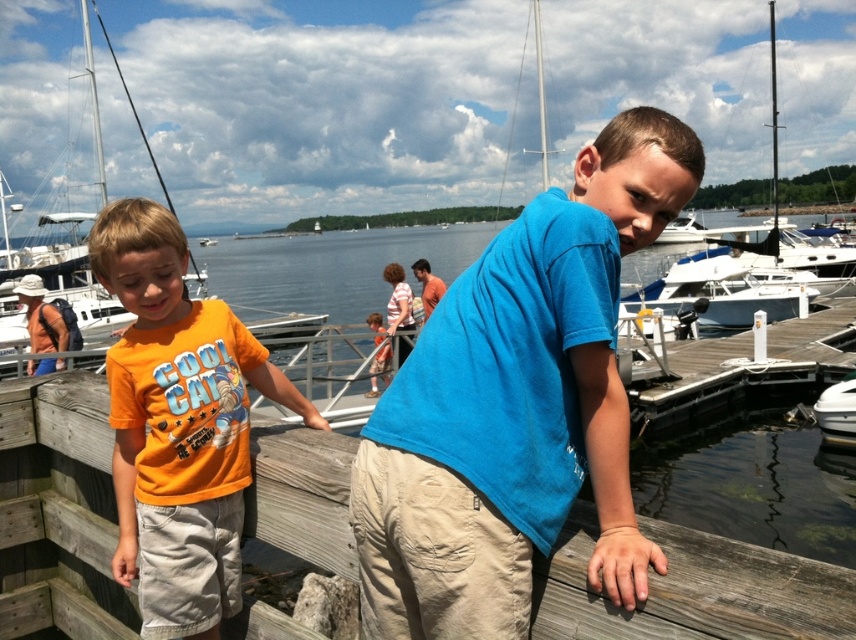
Question: Among these objects, which one is nearest to the camera?

Choices:
 (A) white matte boat at lower right
 (B) orange cotton shirt at center
 (C) transparent water at center
 (D) wooden dock at center

Answer: (C)

Question: Is blue cotton shirt at center wider than white plastic boat at left?

Choices:
 (A) yes
 (B) no

Answer: (B)

Question: Considering the real-world distances, which object is closest to the orange cotton shirt at center?

Choices:
 (A) striped cotton shirt at center
 (B) transparent water at center
 (C) white plastic boat at left
 (D) blue cotton shirt at center

Answer: (A)

Question: Which object is positioned closest to the striped cotton shirt at center?

Choices:
 (A) white matte boat at center
 (B) blue cotton shirt at center

Answer: (B)

Question: Does blue cotton shirt at center appear under striped cotton shirt at center?

Choices:
 (A) no
 (B) yes

Answer: (B)

Question: From the image, what is the correct spatial relationship of white matte boat at lower right in relation to striped cotton shirt at center?

Choices:
 (A) above
 (B) below

Answer: (B)